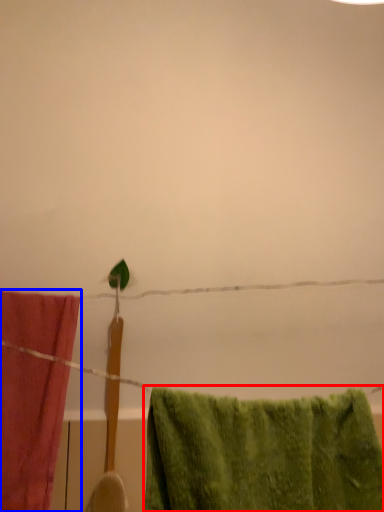
Question: Which point is closer to the camera, towel (highlighted by a red box) or towel (highlighted by a blue box)?

Choices:
 (A) towel
 (B) towel

Answer: (A)